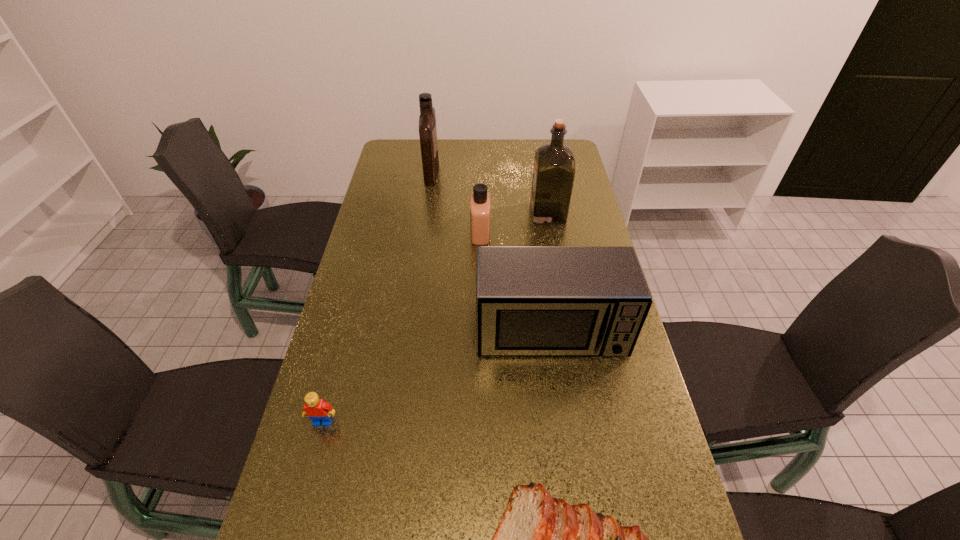
At what (x,y) coordinates should I click in order to perform the action: click on free point that satisfies the following two spatial constraints: 1. on the front label of the fourth tallest object; 2. on the face of the fifth farthest object. Please return your answer as a coordinate pair (x, y). Looking at the image, I should click on (480, 421).

The image size is (960, 540). In order to click on vacant space that satisfies the following two spatial constraints: 1. on the label of the right liquor; 2. on the face of the Lego in this screenshot , I will do [x=586, y=421].